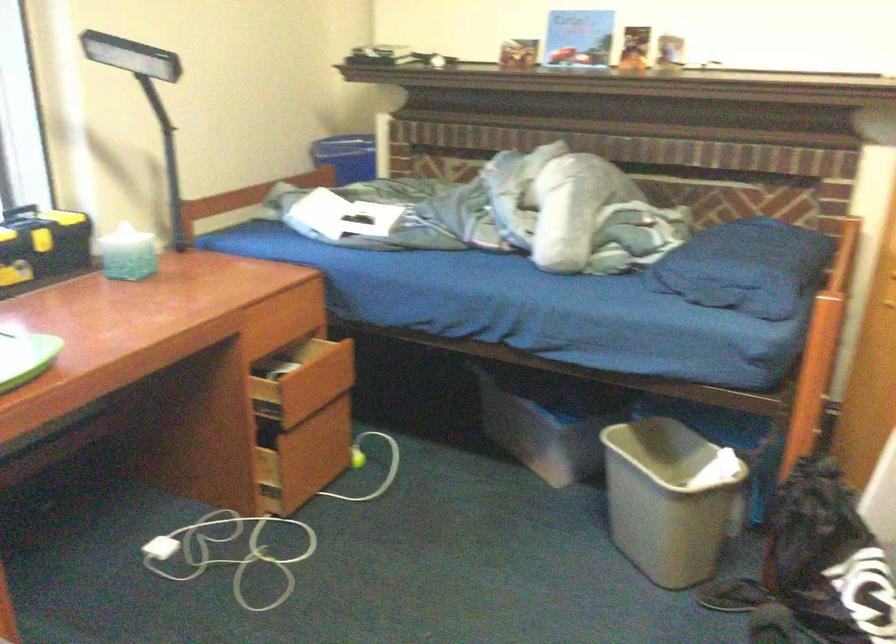
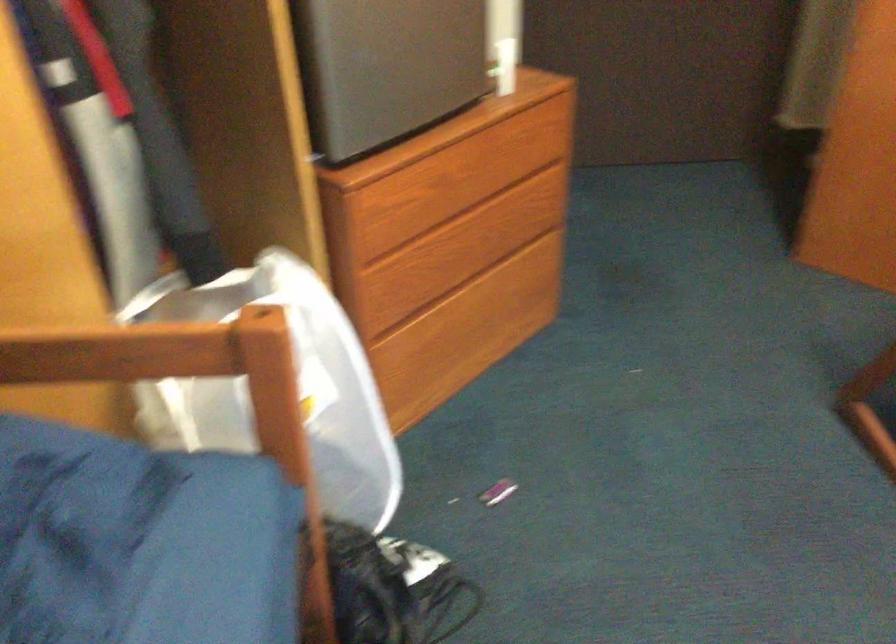
Where in the second image is the point corresponding to pixel 741 304 from the first image?

(73, 529)